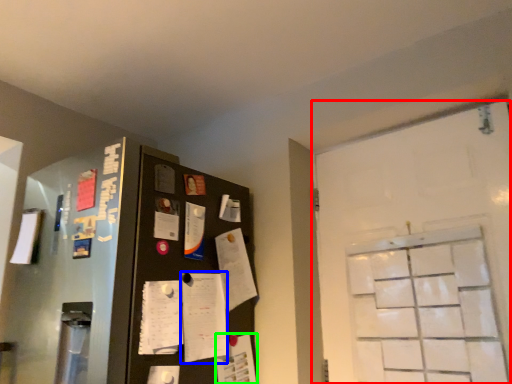
Question: Based on their relative distances, which object is nearer to door (highlighted by a red box)? Choose from notepad (highlighted by a blue box) and paper (highlighted by a green box).

Choices:
 (A) notepad
 (B) paper

Answer: (B)